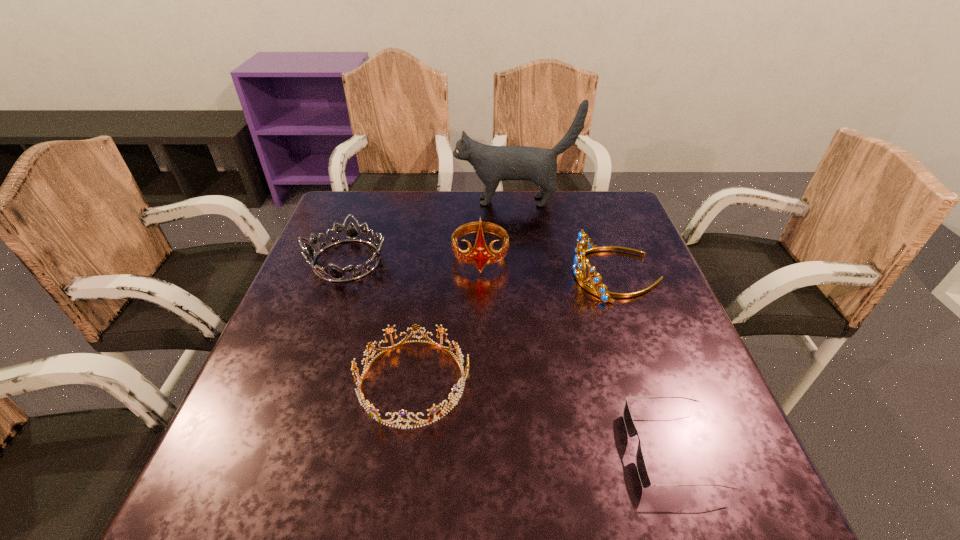
This screenshot has width=960, height=540. Find the location of `vacant space situated on the front-facing side of the tallest tiara`. vacant space situated on the front-facing side of the tallest tiara is located at coordinates (481, 393).

Find the location of `vacant space located on the front-facing side of the second tallest tiara`. vacant space located on the front-facing side of the second tallest tiara is located at coordinates (475, 274).

Locate an element on the screen. free space located on the front-facing side of the second tallest tiara is located at coordinates (455, 274).

I want to click on vacant region located on the front-facing side of the second tallest tiara, so click(471, 274).

The width and height of the screenshot is (960, 540). Identify the location of free space located on the front-facing side of the nearest tiara. (521, 381).

Where is `free space located 0.350m on the front-facing side of the sunglasses`? This screenshot has height=540, width=960. free space located 0.350m on the front-facing side of the sunglasses is located at coordinates (426, 450).

Where is `vacant region located on the front-facing side of the sunglasses`? vacant region located on the front-facing side of the sunglasses is located at coordinates click(x=479, y=450).

Identify the location of blank space located on the front-facing side of the sunglasses. The height and width of the screenshot is (540, 960). (403, 450).

This screenshot has height=540, width=960. In order to click on object that is at the far edge in this screenshot , I will do `click(492, 164)`.

Where is `object that is at the near edge`? The image size is (960, 540). object that is at the near edge is located at coordinates (631, 430).